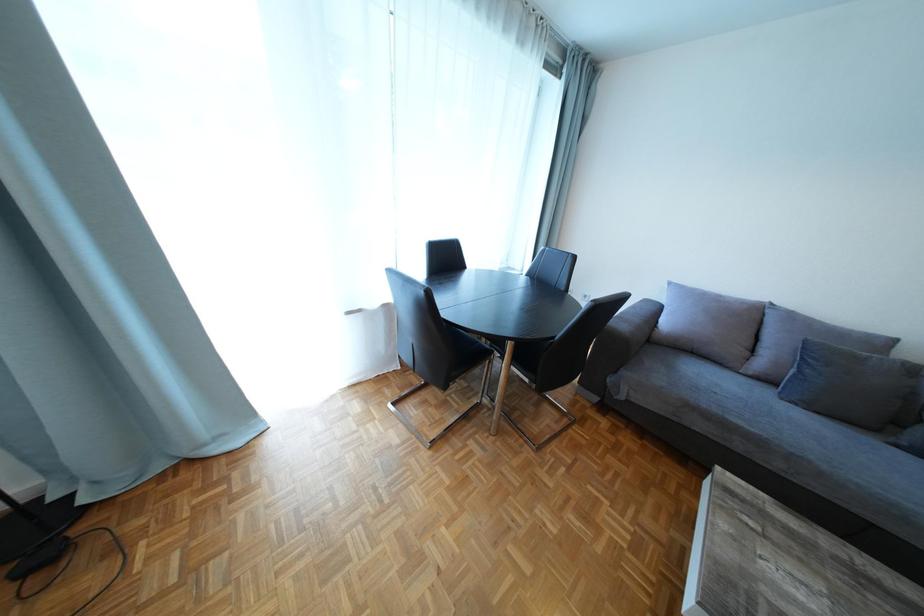
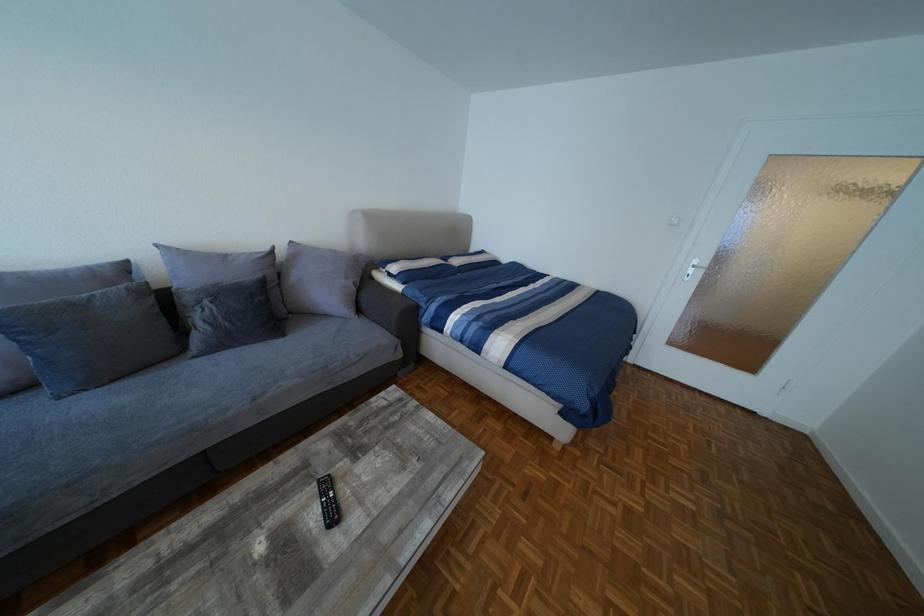
Based on the continuous images, in which direction is the camera rotating?

The camera rotated toward right-down.